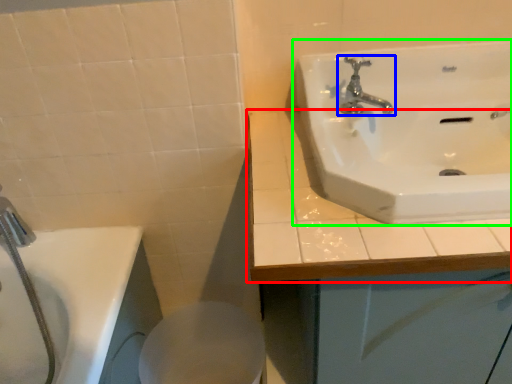
Question: Which object is the farthest from counter top (highlighted by a red box)? Choose among these: tap (highlighted by a blue box) or sink (highlighted by a green box).

Choices:
 (A) tap
 (B) sink

Answer: (A)